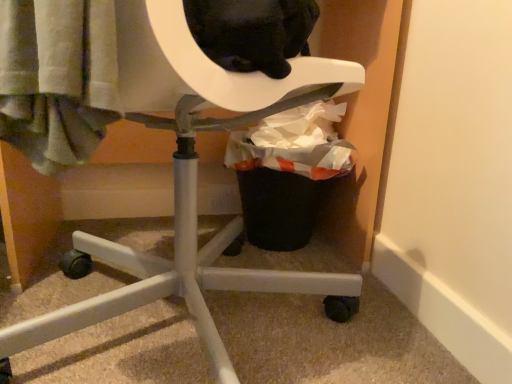
Question: Is black plastic trash can at lower right shorter than white plastic chair at center?

Choices:
 (A) yes
 (B) no

Answer: (A)

Question: Does black plastic trash can at lower right have a lesser width compared to white plastic chair at center?

Choices:
 (A) yes
 (B) no

Answer: (A)

Question: From the image's perspective, is black plastic trash can at lower right located beneath white plastic chair at center?

Choices:
 (A) yes
 (B) no

Answer: (B)

Question: Can you confirm if black plastic trash can at lower right is wider than white plastic chair at center?

Choices:
 (A) yes
 (B) no

Answer: (B)

Question: Is there a large distance between black plastic trash can at lower right and white plastic chair at center?

Choices:
 (A) no
 (B) yes

Answer: (A)

Question: From a real-world perspective, is black plastic trash can at lower right on white plastic chair at center?

Choices:
 (A) no
 (B) yes

Answer: (A)

Question: From the image's perspective, is white plastic chair at center below black plastic trash can at lower right?

Choices:
 (A) yes
 (B) no

Answer: (A)

Question: Is white plastic chair at center positioned behind black plastic trash can at lower right?

Choices:
 (A) no
 (B) yes

Answer: (A)

Question: Is white plastic chair at center thinner than black plastic trash can at lower right?

Choices:
 (A) yes
 (B) no

Answer: (B)

Question: Would you say black plastic trash can at lower right is part of white plastic chair at center's contents?

Choices:
 (A) no
 (B) yes

Answer: (A)

Question: Is the position of white plastic chair at center less distant than that of black plastic trash can at lower right?

Choices:
 (A) no
 (B) yes

Answer: (B)

Question: Is white plastic chair at center oriented away from black plastic trash can at lower right?

Choices:
 (A) no
 (B) yes

Answer: (A)

Question: Considering the positions of black plastic trash can at lower right and white plastic chair at center in the image, is black plastic trash can at lower right wider or thinner than white plastic chair at center?

Choices:
 (A) thin
 (B) wide

Answer: (A)